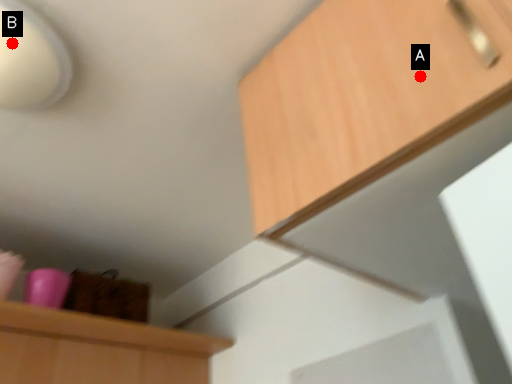
Question: Two points are circled on the image, labeled by A and B beside each circle. Which point is farther to the camera?

Choices:
 (A) A is further
 (B) B is further

Answer: (B)